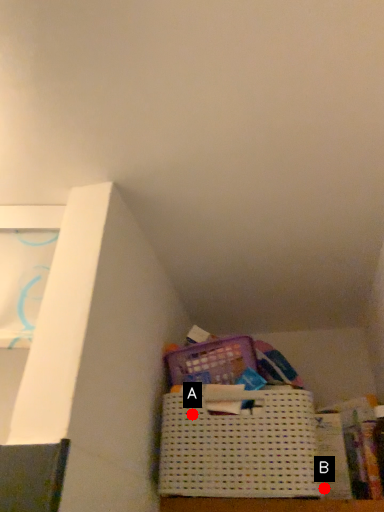
Question: Two points are circled on the image, labeled by A and B beside each circle. Which point is closer to the camera?

Choices:
 (A) A is closer
 (B) B is closer

Answer: (B)